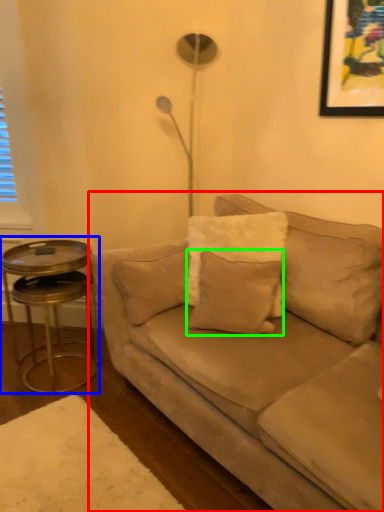
Question: Based on their relative distances, which object is nearer to studio couch (highlighted by a red box)? Choose from table (highlighted by a blue box) and pillow (highlighted by a green box).

Choices:
 (A) table
 (B) pillow

Answer: (B)